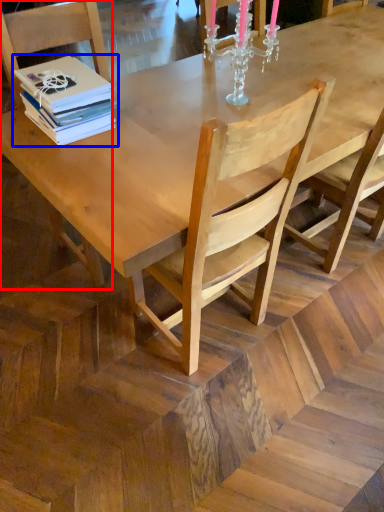
Question: Which of the following is the farthest to the observer, chair (highlighted by a red box) or book (highlighted by a blue box)?

Choices:
 (A) chair
 (B) book

Answer: (B)